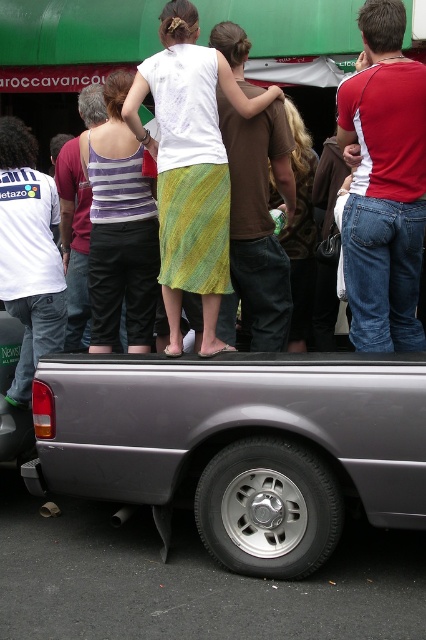
In the scene shown: You are a photographer trying to capture a photo of the matte black truck at center and the white jersey at left. Considering their heights, which object should you focus on first to ensure both are in frame without needing to adjust your camera angle?

The matte black truck at center is taller than the white jersey at left, so you should focus on the matte black truck at center first to ensure both are in frame without needing to adjust your camera angle.

You are a photographer trying to capture a photo of the silver metallic tire at lower center and the white jersey at left. Based on their positions, which object should you focus on first to ensure both are in frame without moving the camera?

The silver metallic tire at lower center is shorter than the white jersey at left, so you should focus on the white jersey at left first to ensure both are in frame without moving the camera.